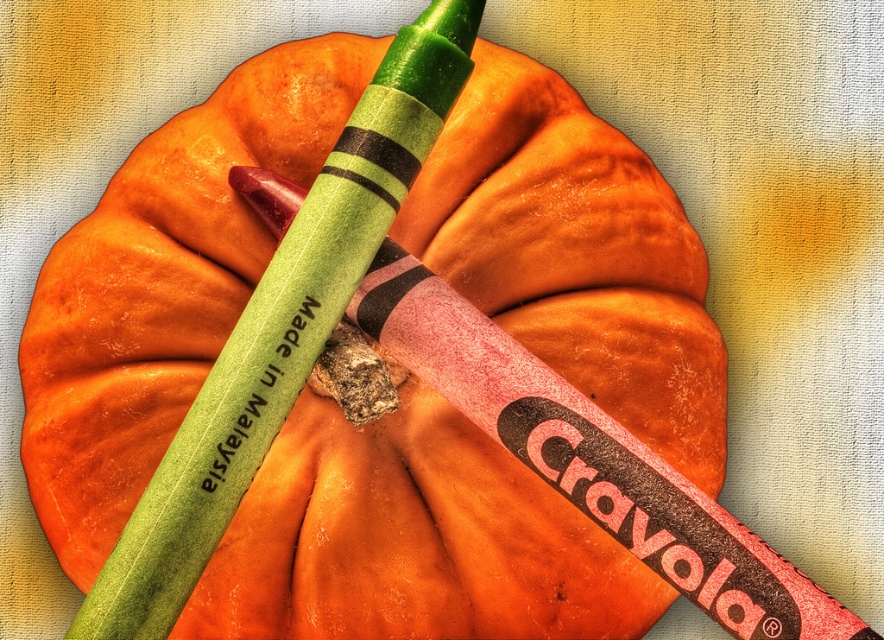
Question: Does green matte crayon at upper center appear on the right side of black matte text at center?

Choices:
 (A) no
 (B) yes

Answer: (B)

Question: Is green matte crayon at upper center smaller than black matte text at center?

Choices:
 (A) no
 (B) yes

Answer: (A)

Question: Which object appears farthest from the camera in this image?

Choices:
 (A) black matte text at center
 (B) green matte crayon at upper center

Answer: (A)

Question: From the image, what is the correct spatial relationship of green matte crayon at upper center in relation to black matte text at center?

Choices:
 (A) right
 (B) left

Answer: (A)